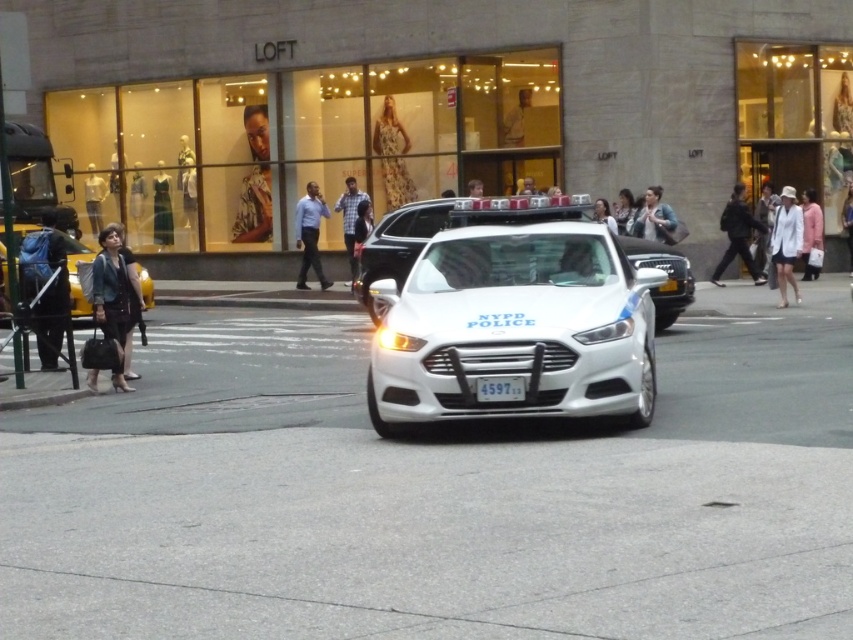
Does dark gray leather jacket at left appear under floral dress at center?

Yes.

Which is below, dark gray leather jacket at left or floral dress at center?

dark gray leather jacket at left

Is point (114, 276) in front of point (379, 129)?

Yes, it is in front of point (379, 129).

This screenshot has width=853, height=640. In order to click on dark gray leather jacket at left in this screenshot , I will do `click(112, 298)`.

Does white asphalt at center have a greater width compared to light brown leather jacket at center?

Correct, the width of white asphalt at center exceeds that of light brown leather jacket at center.

Based on the photo, does white asphalt at center have a lesser height compared to light brown leather jacket at center?

No, white asphalt at center is not shorter than light brown leather jacket at center.

Where is `white asphalt at center`? This screenshot has width=853, height=640. white asphalt at center is located at coordinates (438, 493).

Can you confirm if leopard print jacket at upper center is taller than matte black dress at upper left?

Yes.

From the picture: Is leopard print jacket at upper center to the right of matte black dress at upper left from the viewer's perspective?

Indeed, leopard print jacket at upper center is positioned on the right side of matte black dress at upper left.

Between point (270, 237) and point (88, 177), which one is positioned in front?

Point (270, 237) is in front.

This screenshot has height=640, width=853. Identify the location of leopard print jacket at upper center. (254, 180).